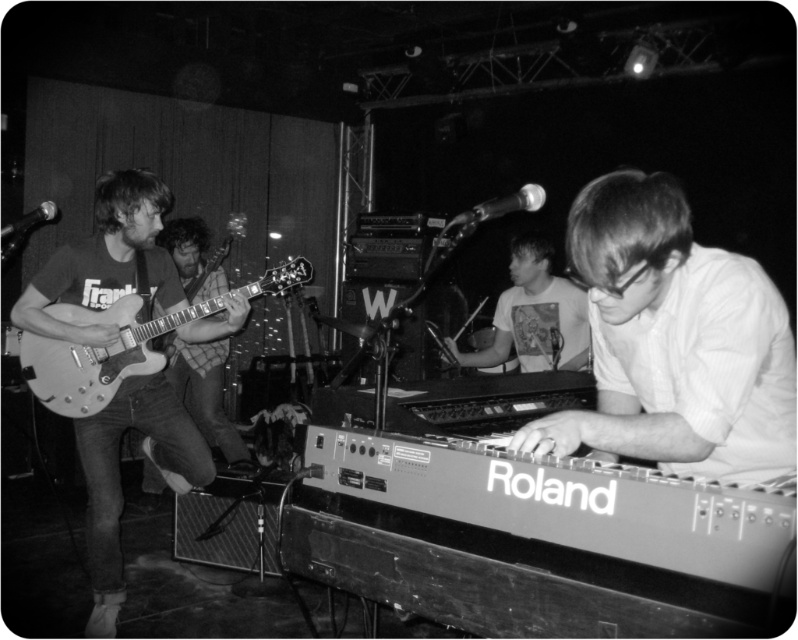
Question: Among these points, which one is farthest from the camera?

Choices:
 (A) (188, 355)
 (B) (58, 396)
 (C) (556, 324)

Answer: (A)

Question: Does metallic electric guitar at left come behind white printed t-shirt at center?

Choices:
 (A) no
 (B) yes

Answer: (A)

Question: Which object is the farthest from the metallic guitar at left?

Choices:
 (A) matte wood guitar at left
 (B) white printed t-shirt at center
 (C) white matte keyboard at center

Answer: (C)

Question: Is the position of white printed t-shirt at center more distant than that of metallic guitar at left?

Choices:
 (A) yes
 (B) no

Answer: (B)

Question: Considering the relative positions of matte wood guitar at left and white printed t-shirt at center in the image provided, where is matte wood guitar at left located with respect to white printed t-shirt at center?

Choices:
 (A) above
 (B) below

Answer: (B)

Question: Which point is closer to the camera?

Choices:
 (A) metallic guitar at left
 (B) matte wood guitar at left

Answer: (B)